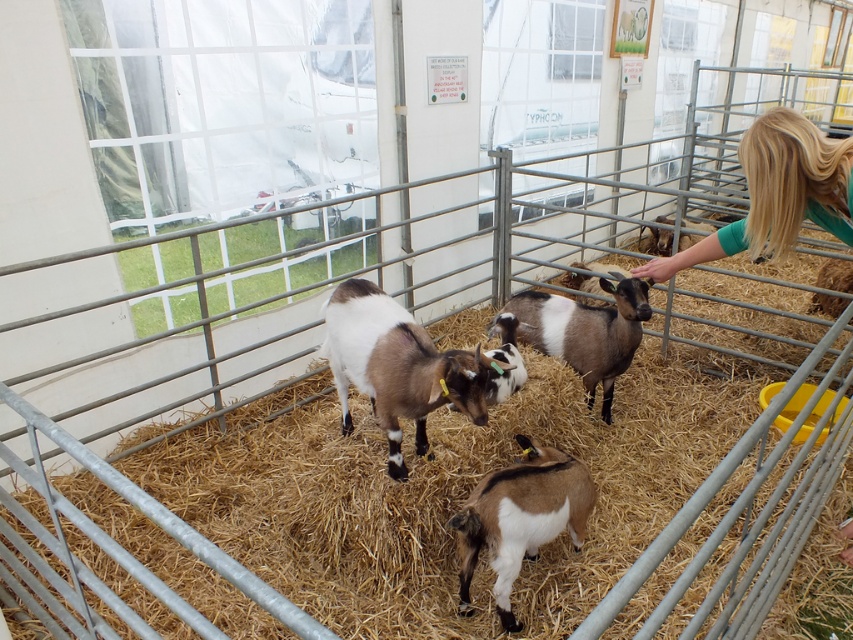
Which of these two, brown fuzzy goat at center or brown speckled fur at center, stands shorter?

With less height is brown fuzzy goat at center.

Find the location of a particular element. The width and height of the screenshot is (853, 640). brown fuzzy goat at center is located at coordinates (520, 516).

Is brown and white fur goat at center thinner than brown speckled fur at center?

Yes.

Can you confirm if brown and white fur goat at center is smaller than brown speckled fur at center?

Yes.

Does point (347, 365) lie behind point (619, 292)?

No, (347, 365) is in front of (619, 292).

The height and width of the screenshot is (640, 853). Find the location of `brown and white fur goat at center`. brown and white fur goat at center is located at coordinates pos(395,365).

Which is more to the right, brown and white fur goat at center or blonde hair at right?

Positioned to the right is blonde hair at right.

Is point (428, 394) farther from camera compared to point (808, 188)?

That is True.

I want to click on brown and white fur goat at center, so click(395, 365).